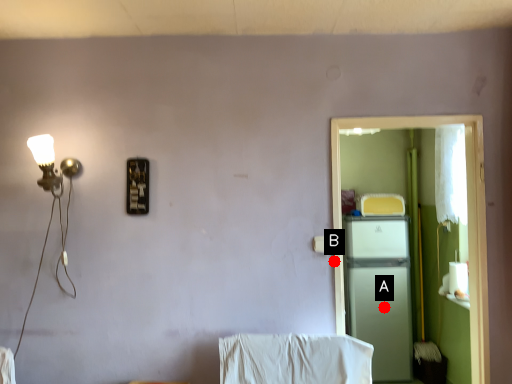
Question: Two points are circled on the image, labeled by A and B beside each circle. Which point is further to the camera?

Choices:
 (A) A is further
 (B) B is further

Answer: (A)